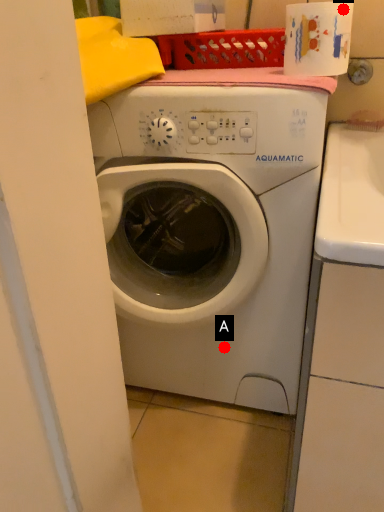
Question: Two points are circled on the image, labeled by A and B beside each circle. Which of the following is the farthest from the observer?

Choices:
 (A) A is further
 (B) B is further

Answer: (A)